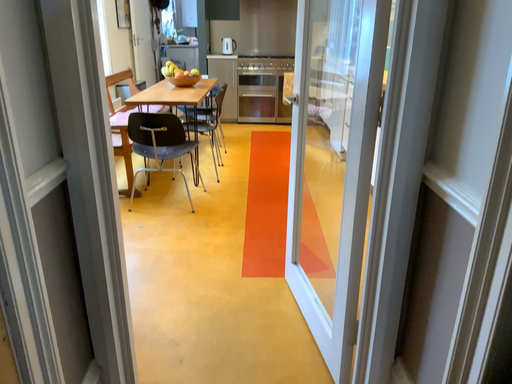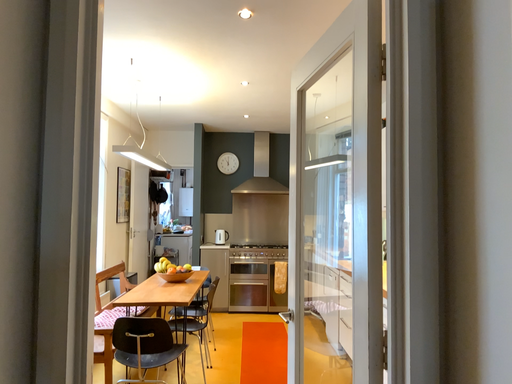
Question: Which way did the camera rotate in the video?

Choices:
 (A) rotated upward
 (B) rotated downward

Answer: (A)